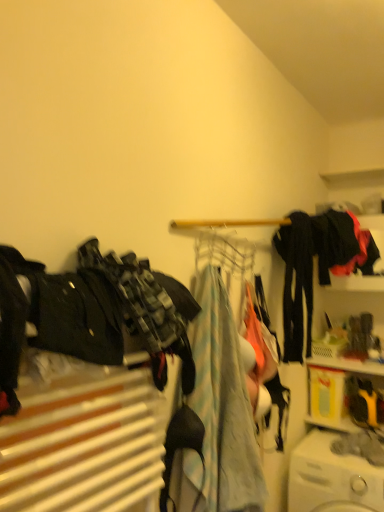
Question: Is black matte pants at center right, which is the 2th clothing in back-to-front order, further to camera compared to white plastic washing machine at lower right?

Choices:
 (A) yes
 (B) no

Answer: (A)

Question: Can you confirm if black matte pants at center right, which is the 2th clothing in back-to-front order, is smaller than white plastic washing machine at lower right?

Choices:
 (A) yes
 (B) no

Answer: (A)

Question: From the image's perspective, does black matte pants at center right, which is the 2th clothing in back-to-front order, appear higher than white plastic washing machine at lower right?

Choices:
 (A) yes
 (B) no

Answer: (A)

Question: Is black matte pants at center right, the 3th clothing in the front-to-back sequence, oriented away from white plastic washing machine at lower right?

Choices:
 (A) yes
 (B) no

Answer: (B)

Question: Considering the relative sizes of black matte pants at center right, the second clothing when ordered from right to left, and white plastic washing machine at lower right in the image provided, is black matte pants at center right, the second clothing when ordered from right to left, thinner than white plastic washing machine at lower right?

Choices:
 (A) no
 (B) yes

Answer: (B)

Question: Is black matte pants at center right, the 3th clothing in the front-to-back sequence, to the left or to the right of black matte jacket at upper right, which is the fourth clothing from front to back, in the image?

Choices:
 (A) left
 (B) right

Answer: (A)

Question: In terms of width, does black matte pants at center right, the second clothing when ordered from right to left, look wider or thinner when compared to black matte jacket at upper right, which is the 4th clothing from left to right?

Choices:
 (A) thin
 (B) wide

Answer: (A)

Question: Which is correct: black matte pants at center right, which is the 2th clothing in back-to-front order, is inside black matte jacket at upper right, which is the fourth clothing from front to back, or outside of it?

Choices:
 (A) inside
 (B) outside

Answer: (B)

Question: From a real-world perspective, relative to black matte jacket at upper right, which is the 4th clothing from left to right, is black matte pants at center right, which is counted as the third clothing, starting from the left, vertically above or below?

Choices:
 (A) below
 (B) above

Answer: (A)

Question: Looking at the image, does camouflage fabric pants at left, the 1th clothing from the left, seem bigger or smaller compared to metallic wire clothesline at center?

Choices:
 (A) big
 (B) small

Answer: (A)

Question: Is camouflage fabric pants at left, which ranks as the fourth clothing in right-to-left order, wider or thinner than metallic wire clothesline at center?

Choices:
 (A) thin
 (B) wide

Answer: (B)

Question: Is camouflage fabric pants at left, which is counted as the fourth clothing, starting from the back, to the left or to the right of metallic wire clothesline at center in the image?

Choices:
 (A) left
 (B) right

Answer: (A)

Question: Is camouflage fabric pants at left, the 1th clothing from the left, inside or outside of metallic wire clothesline at center?

Choices:
 (A) inside
 (B) outside

Answer: (B)

Question: From a real-world perspective, relative to white plastic washing machine at lower right, is light blue fabric at center, which appears as the 3th clothing when viewed from the back, vertically above or below?

Choices:
 (A) below
 (B) above

Answer: (B)

Question: Looking at their shapes, would you say light blue fabric at center, which is the 2th clothing from front to back, is wider or thinner than white plastic washing machine at lower right?

Choices:
 (A) wide
 (B) thin

Answer: (B)